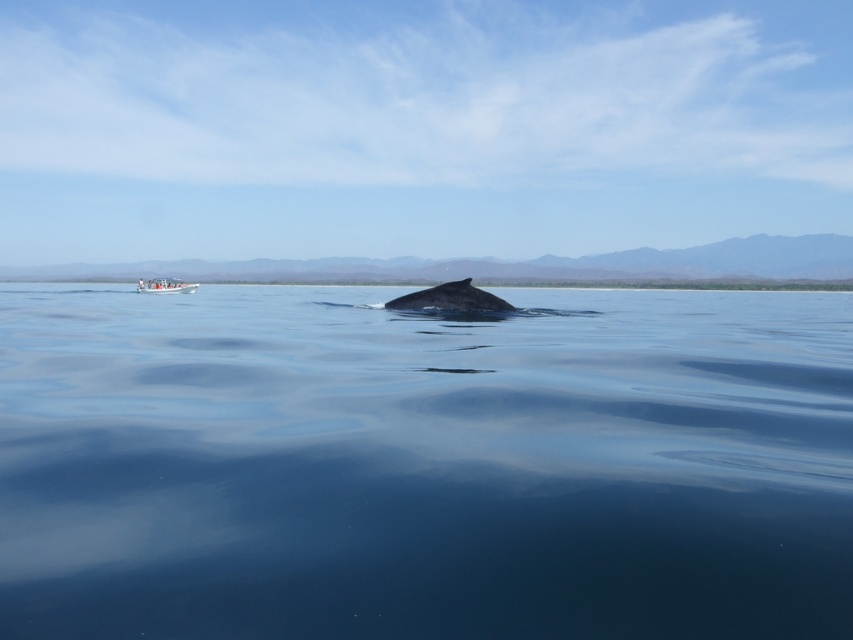
Question: Is clear blue water at center bigger than smooth gray whale at center?

Choices:
 (A) no
 (B) yes

Answer: (B)

Question: Estimate the real-world distances between objects in this image. Which object is closer to the smooth gray whale at center?

Choices:
 (A) clear blue water at center
 (B) white plastic boat at lower left

Answer: (A)

Question: Does clear blue water at center lie behind white plastic boat at lower left?

Choices:
 (A) no
 (B) yes

Answer: (A)

Question: Which object appears closest to the camera in this image?

Choices:
 (A) clear blue water at center
 (B) white plastic boat at lower left
 (C) smooth gray whale at center

Answer: (A)

Question: Does clear blue water at center appear on the right side of smooth gray whale at center?

Choices:
 (A) yes
 (B) no

Answer: (B)

Question: Among these objects, which one is farthest from the camera?

Choices:
 (A) white plastic boat at lower left
 (B) clear blue water at center

Answer: (A)